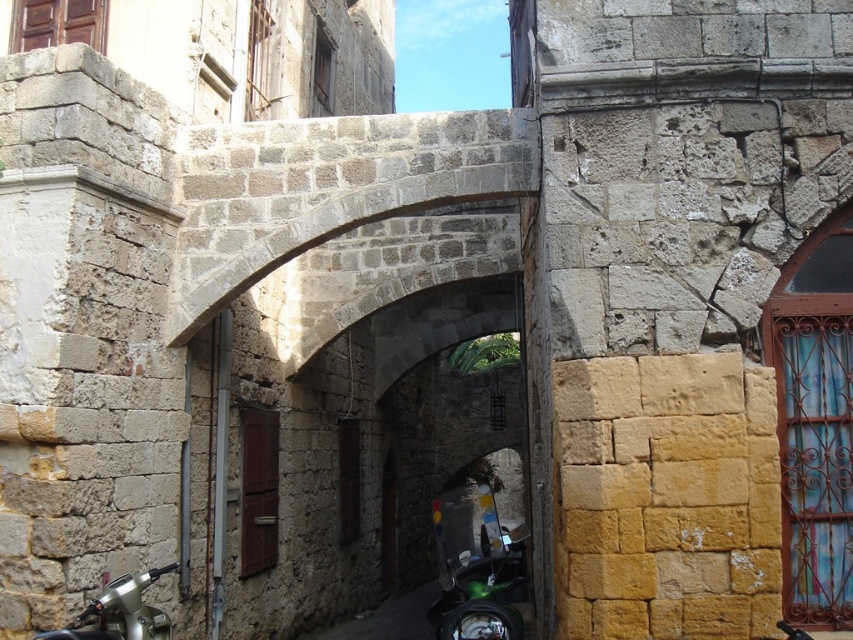
You are a delivery driver needing to park your motorcycle in this alley. You see a shiny metallic motorcycle at lower right and a metallic silver motorcycle at lower left. Which motorcycle takes up more space in the narrow alley?

The shiny metallic motorcycle at lower right takes up more space in the narrow alley because it is bigger than the metallic silver motorcycle at lower left.

You are a delivery person who needs to pass through the stone archway in the alley. You have a shiny metallic motorcycle at lower right and a metallic silver motorcycle at lower left. Which motorcycle should you choose to ensure it can pass under the archway without hitting the top?

The metallic silver motorcycle at lower left is shorter in height compared to the shiny metallic motorcycle at lower right. Therefore, the metallic silver motorcycle at lower left should be chosen to safely pass under the archway without hitting the top.

You are standing in the alleyway and see a shiny metallic motorcycle at lower right. What is the purpose of the point at coordinate (476, 566)?

The point at coordinate (476, 566) is located on the shiny metallic motorcycle at lower right.